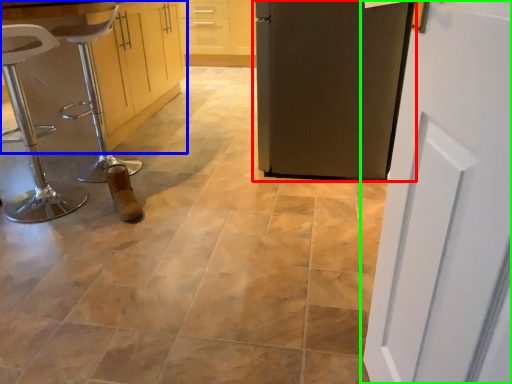
Question: Which is farther away from door (highlighted by a red box)? cabinetry (highlighted by a blue box) or door (highlighted by a green box)?

Choices:
 (A) cabinetry
 (B) door

Answer: (A)